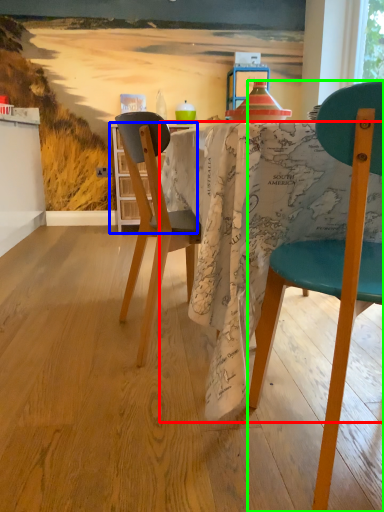
Question: Which object is positioned closest to desk (highlighted by a red box)? Select from kitchen & dining room table (highlighted by a blue box) and chair (highlighted by a green box).

Choices:
 (A) kitchen & dining room table
 (B) chair

Answer: (B)